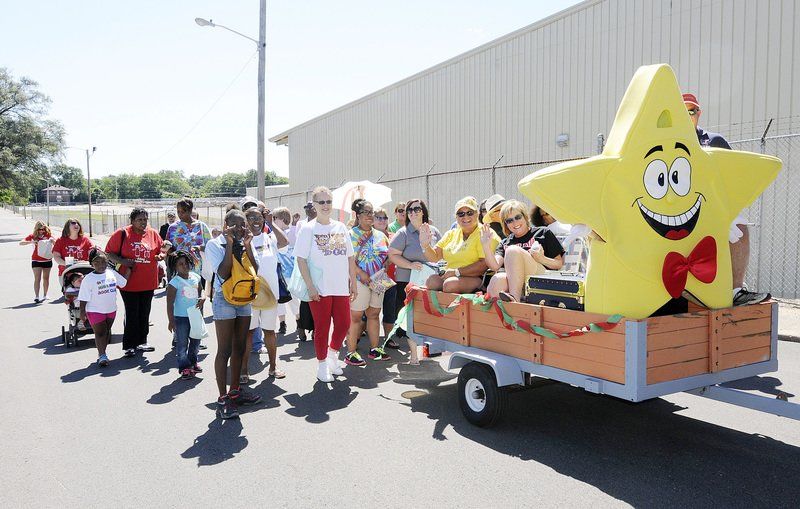
Where is `big yellow foam star decoration`? This screenshot has height=509, width=800. big yellow foam star decoration is located at coordinates (605, 189).